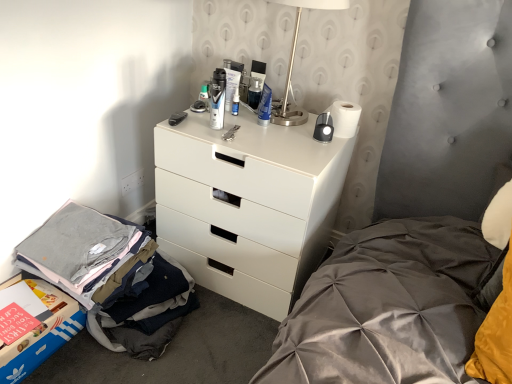
Identify the location of free space in front of white matte toilet paper at upper right. The image size is (512, 384). (318, 148).